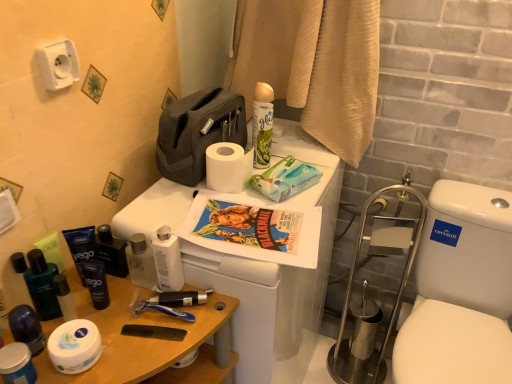
Where is `vacant space to the left of white matte lotion at center, the 1th toiletry when ordered from right to left`? The width and height of the screenshot is (512, 384). vacant space to the left of white matte lotion at center, the 1th toiletry when ordered from right to left is located at coordinates (108, 301).